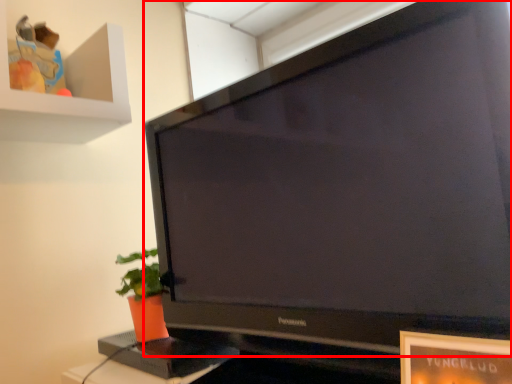
Question: From the image's perspective, where is television (annotated by the red box) located in relation to houseplant in the image?

Choices:
 (A) above
 (B) below

Answer: (A)